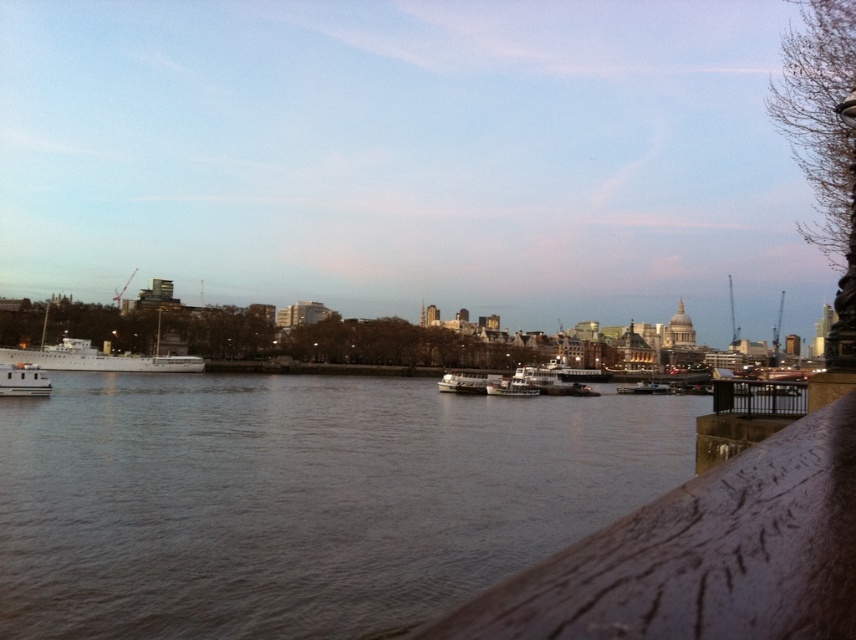
Question: Does brown water at center appear on the left side of white matte ship at left?

Choices:
 (A) no
 (B) yes

Answer: (A)

Question: Is brown water at center closer to the viewer compared to white matte boat at center?

Choices:
 (A) no
 (B) yes

Answer: (B)

Question: Which of the following is the closest to the observer?

Choices:
 (A) (40, 374)
 (B) (92, 460)

Answer: (B)

Question: Considering the real-world distances, which object is closest to the white matte ship at left?

Choices:
 (A) white matte boat at center
 (B) brown water at center

Answer: (B)

Question: Which object is the closest to the brown water at center?

Choices:
 (A) white matte boat at center
 (B) white matte boat at left

Answer: (B)

Question: Observing the image, what is the correct spatial positioning of white matte boat at left in reference to metallic silver boat at center?

Choices:
 (A) right
 (B) left

Answer: (B)